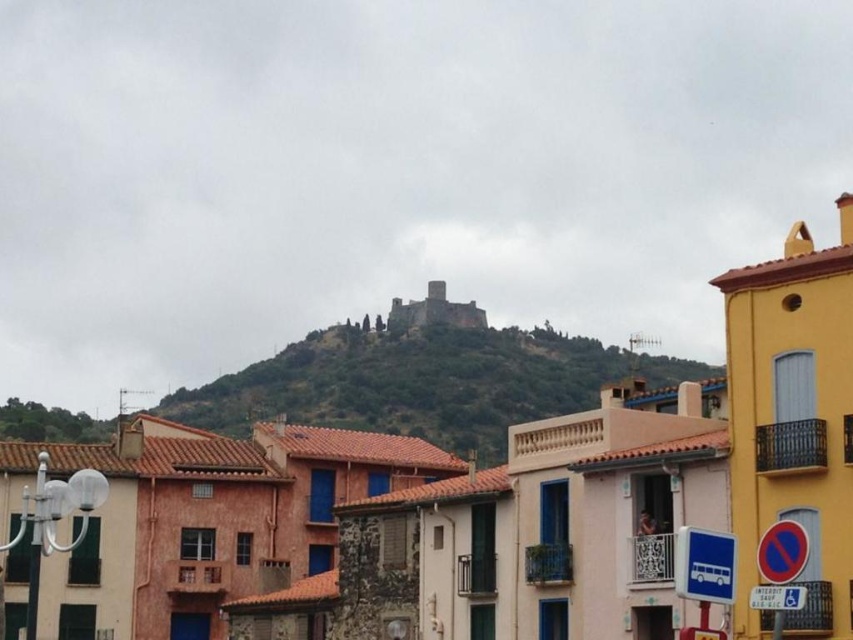
Can you confirm if terracotta clay roof tiles at upper center is taller than green grassy hillside at center?

No, terracotta clay roof tiles at upper center is not taller than green grassy hillside at center.

Who is more forward, (x=374, y=524) or (x=546, y=337)?

Point (x=374, y=524)

Who is more distant from viewer, (360, 596) or (386, 397)?

Point (386, 397)

I want to click on terracotta clay roof tiles at upper center, so click(469, 499).